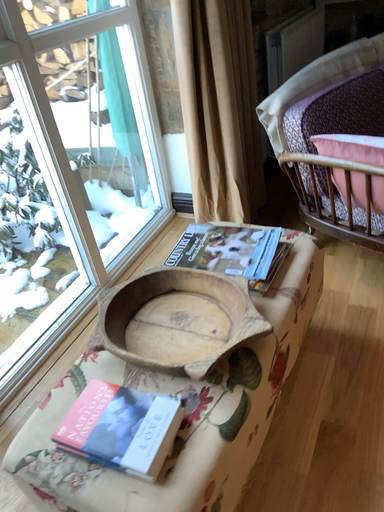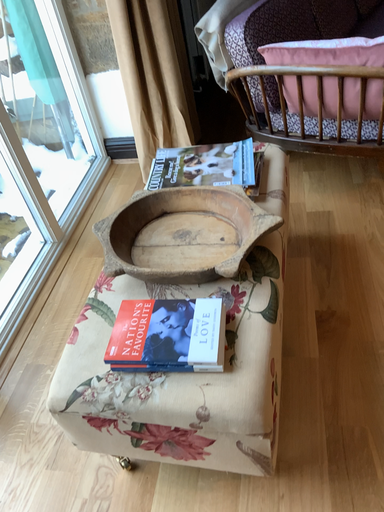
Question: Which way did the camera rotate in the video?

Choices:
 (A) rotated right
 (B) rotated left

Answer: (A)